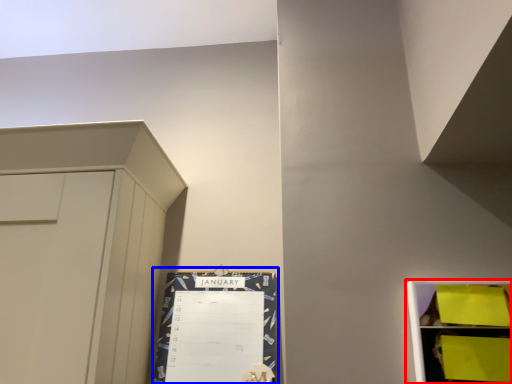
Question: Which object appears closest to the camera in this image, shelf (highlighted by a red box) or bulletin board (highlighted by a blue box)?

Choices:
 (A) shelf
 (B) bulletin board

Answer: (A)